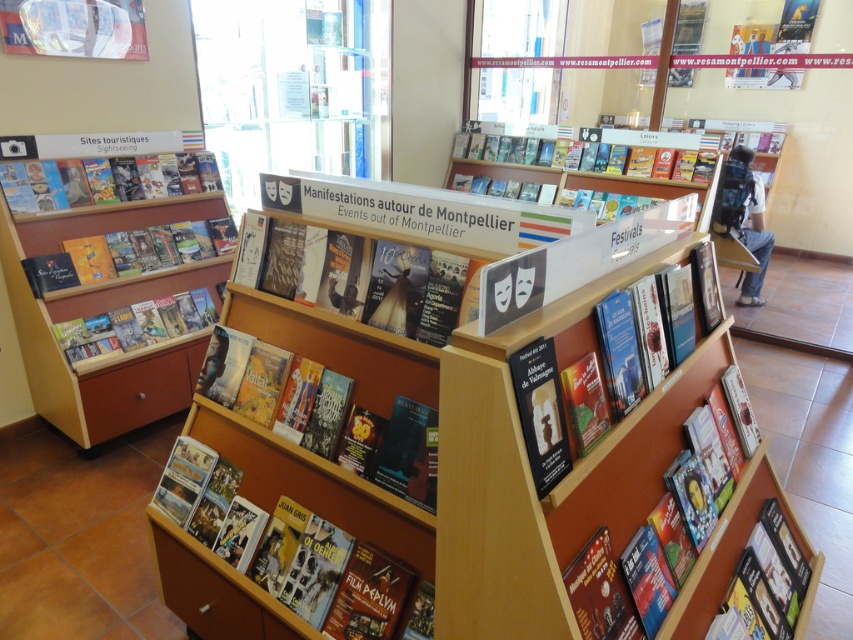
You are a tourist visiting Montpellier and need to choose between the matte cardboard book at center and the hardcover book at center for your trip planning. Which one is taller?

The matte cardboard book at center is taller than the hardcover book at center.

You are a tourist looking for a guidebook in the Montpellier information center. You see the matte cardboard book at center and the matte black book at left. Which one is taller?

The matte cardboard book at center is taller than the matte black book at left.